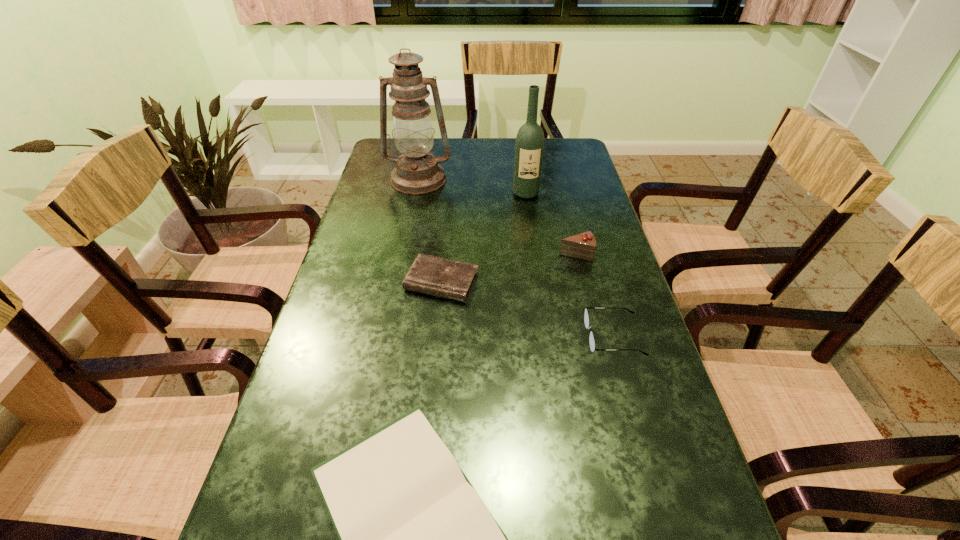
The image size is (960, 540). In order to click on vacant space situated on the back of the third farthest object in this screenshot , I will do `click(559, 184)`.

Identify the location of blank area located on the lenses of the spectacles. Image resolution: width=960 pixels, height=540 pixels. 456,336.

At what (x,y) coordinates should I click in order to perform the action: click on free space located 0.400m on the lenses of the spectacles. Please return your answer as a coordinate pair (x, y). This screenshot has height=540, width=960. Looking at the image, I should click on (407, 336).

Identify the location of vacant space situated on the lenses of the spectacles. (416, 336).

This screenshot has width=960, height=540. In order to click on free space located on the right of the diary in this screenshot , I will do `click(535, 282)`.

Locate an element on the screen. The width and height of the screenshot is (960, 540). object located in the far edge section of the desktop is located at coordinates (417, 171).

I want to click on object that is at the left edge, so click(417, 171).

Locate an element on the screen. This screenshot has height=540, width=960. chocolate cake situated at the right edge is located at coordinates (582, 246).

Identify the location of spectacles at the right edge. The width and height of the screenshot is (960, 540). (586, 317).

Locate an element on the screen. The height and width of the screenshot is (540, 960). object that is at the far left corner is located at coordinates (417, 171).